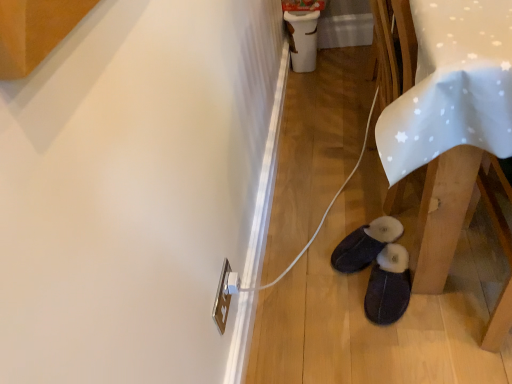
The image size is (512, 384). Identify the location of vacant area that lies in front of dark gray suede slippers at lower center, the 1th footwear when ordered from front to back. (420, 344).